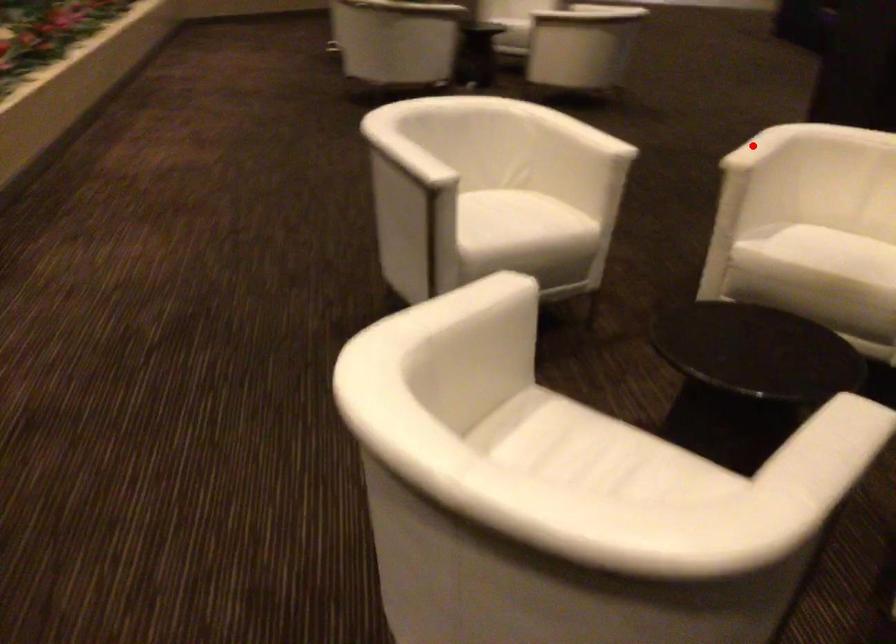
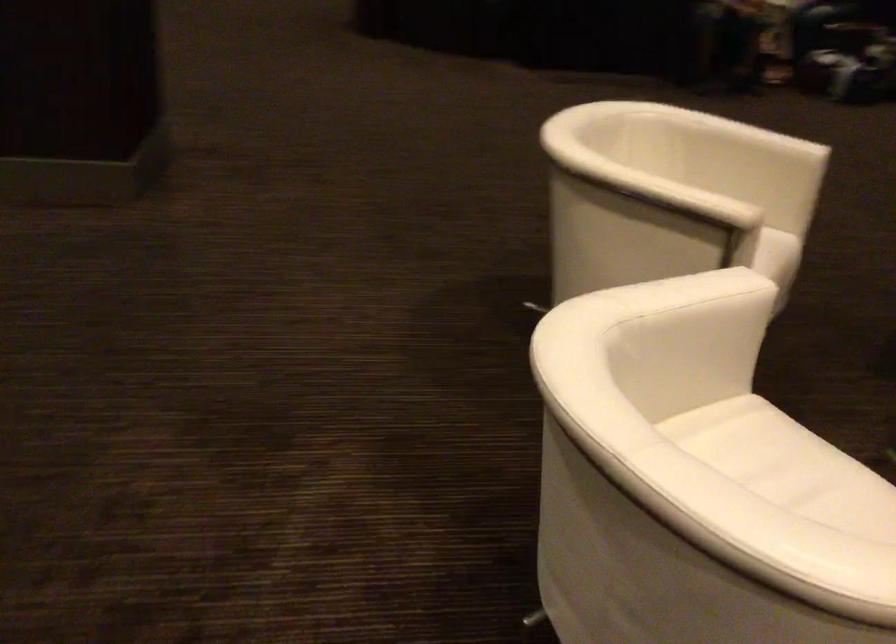
Question: I am providing you with two images of the same scene from different viewpoints. Given a red point in image1, look at the same physical point in image2. Is it:

Choices:
 (A) Closer to the viewpoint
 (B) Farther from the viewpoint

Answer: (A)